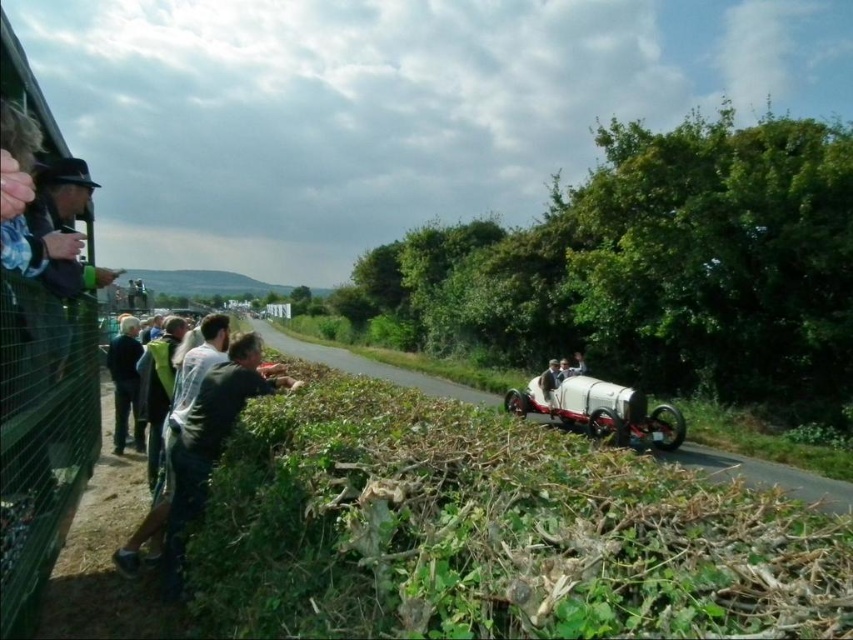
Question: Which point is closer to the camera?

Choices:
 (A) (506, 394)
 (B) (115, 436)

Answer: (B)

Question: In this image, where is white matte vintage car at center-right located relative to dark gray jacket at left?

Choices:
 (A) right
 (B) left

Answer: (A)

Question: Is white matte vintage car at center-right behind dark gray jacket at left?

Choices:
 (A) yes
 (B) no

Answer: (A)

Question: Does white matte vintage car at center-right appear on the left side of dark gray jacket at left?

Choices:
 (A) yes
 (B) no

Answer: (B)

Question: Among these points, which one is farthest from the camera?

Choices:
 (A) (141, 429)
 (B) (633, 419)

Answer: (B)

Question: Among these points, which one is farthest from the camera?

Choices:
 (A) (665, 416)
 (B) (122, 444)

Answer: (A)